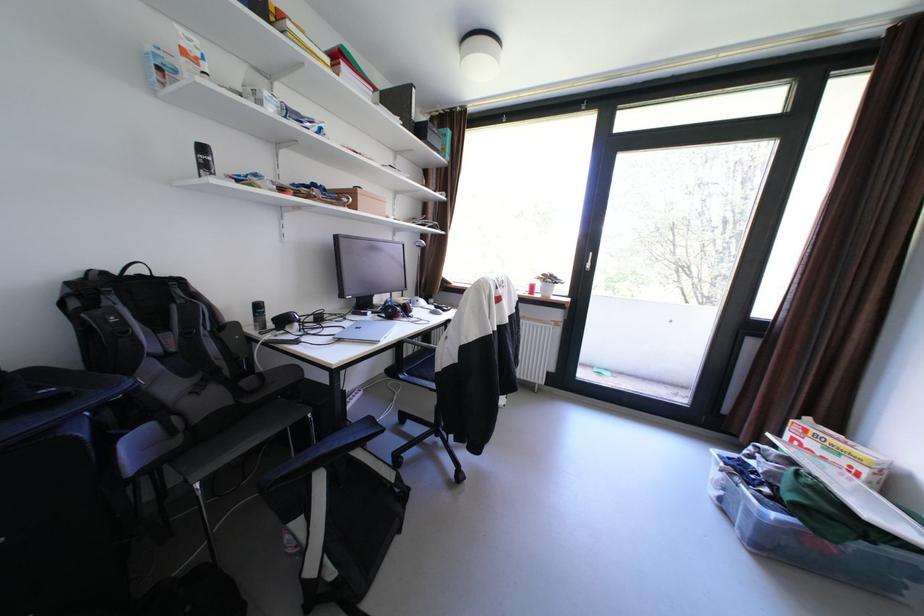
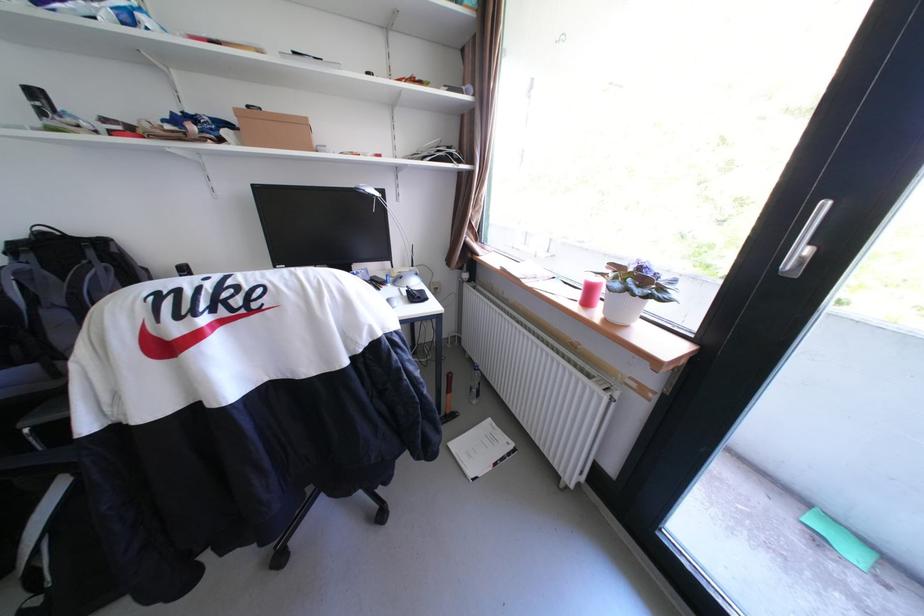
Find the pixel in the second image that matches the point at 445,306 in the first image.

(418, 291)